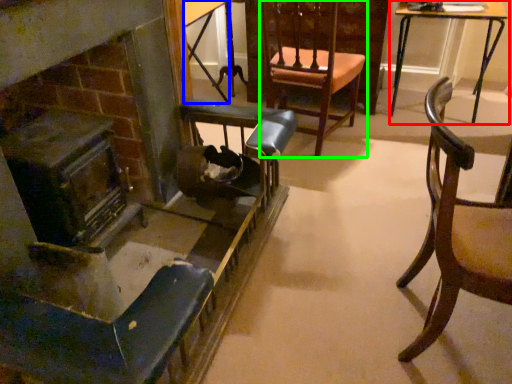
Question: Which object is positioned closest to table (highlighted by a red box)? Select from table (highlighted by a blue box) and chair (highlighted by a green box).

Choices:
 (A) table
 (B) chair

Answer: (B)